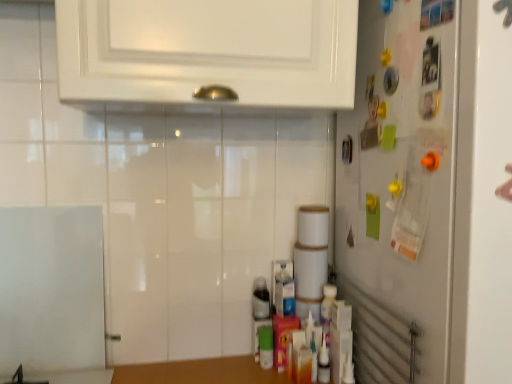
This screenshot has height=384, width=512. What do you see at coordinates (428, 192) in the screenshot? I see `white matte refrigerator at right` at bounding box center [428, 192].

Where is `white matte refrigerator at right`? The height and width of the screenshot is (384, 512). white matte refrigerator at right is located at coordinates (428, 192).

Locate an element on the screen. Image resolution: width=512 pixels, height=384 pixels. white matte refrigerator at right is located at coordinates (428, 192).